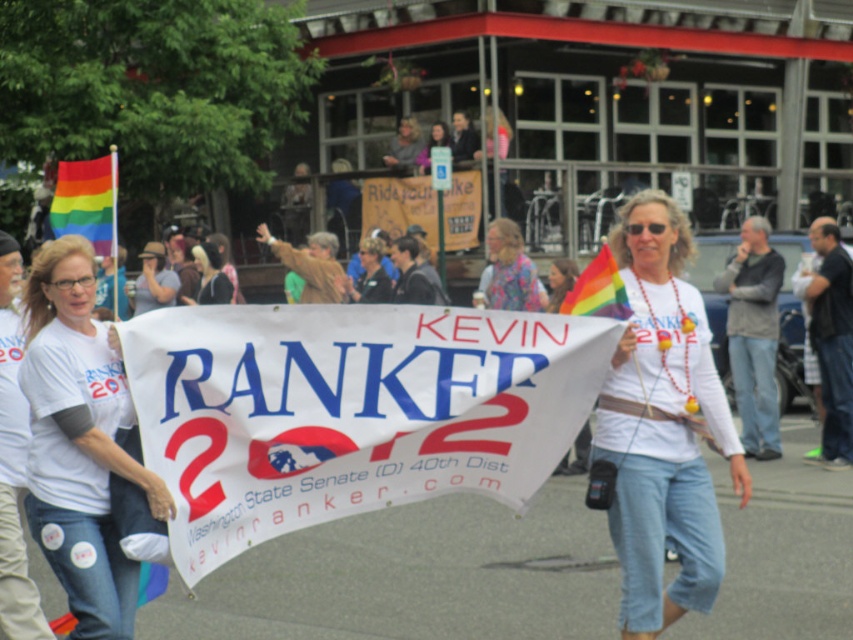
Does white paper banner at center have a smaller size compared to floral fabric shirt at center?

Incorrect, white paper banner at center is not smaller in size than floral fabric shirt at center.

Between white paper banner at center and floral fabric shirt at center, which one has less height?

Standing shorter between the two is floral fabric shirt at center.

Is point (381, 413) positioned before point (495, 266)?

That is True.

This screenshot has height=640, width=853. Identify the location of white paper banner at center. (349, 410).

Is white matte t-shirt at center smaller than rainbow fabric flag at upper left?

Actually, white matte t-shirt at center might be larger than rainbow fabric flag at upper left.

Can you confirm if white matte t-shirt at center is bigger than rainbow fabric flag at upper left?

Yes.

Where is `white matte t-shirt at center`? white matte t-shirt at center is located at coordinates (663, 426).

The height and width of the screenshot is (640, 853). Find the location of `white matte t-shirt at center`. white matte t-shirt at center is located at coordinates (663, 426).

Between point (515, 227) and point (213, 246), which one is positioned in front?

Point (515, 227)

The height and width of the screenshot is (640, 853). What do you see at coordinates (509, 269) in the screenshot? I see `floral fabric shirt at center` at bounding box center [509, 269].

I want to click on floral fabric shirt at center, so click(x=509, y=269).